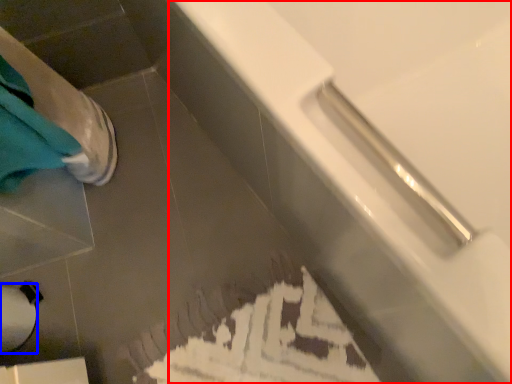
Question: Among these objects, which one is nearest to the camera, bathtub (highlighted by a red box) or toilet paper (highlighted by a blue box)?

Choices:
 (A) bathtub
 (B) toilet paper

Answer: (A)